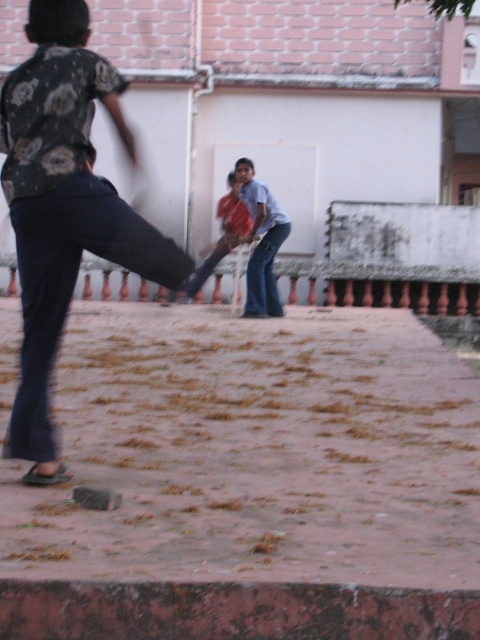
Question: Is dark blue jeans at center positioned before reddish-orange fabric at center?

Choices:
 (A) no
 (B) yes

Answer: (B)

Question: Which point is closer to the camera taking this photo?

Choices:
 (A) (230, 182)
 (B) (37, 148)

Answer: (B)

Question: Is dark blue jeans at center to the right of reddish-orange fabric at center from the viewer's perspective?

Choices:
 (A) yes
 (B) no

Answer: (B)

Question: Can you confirm if dark blue jeans at center is positioned above reddish-orange fabric at center?

Choices:
 (A) no
 (B) yes

Answer: (A)